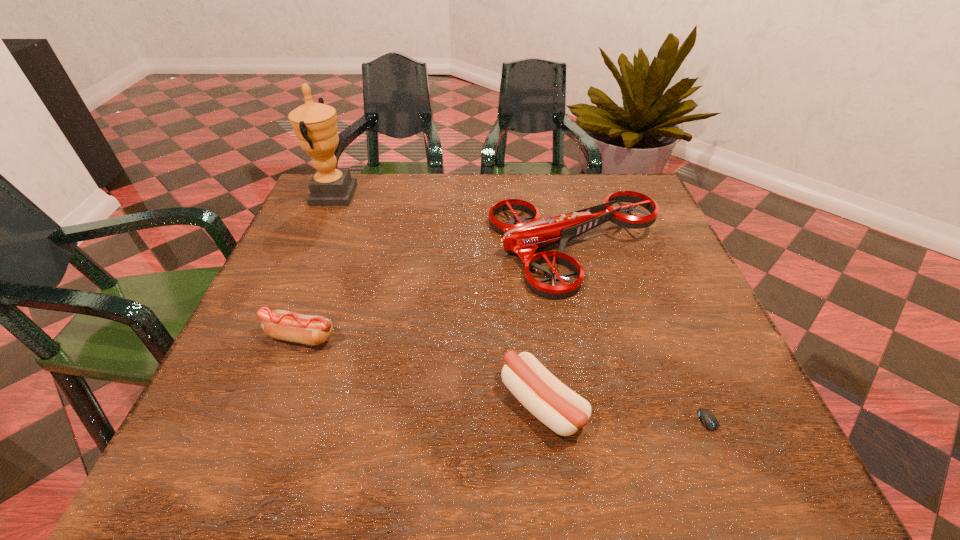
The image size is (960, 540). In order to click on award in this screenshot , I will do `click(315, 124)`.

Where is `drone`? drone is located at coordinates (523, 239).

What are the coordinates of `the third farthest object` in the screenshot? It's located at (286, 325).

In order to click on the left sausage in this screenshot , I will do `click(286, 325)`.

Identify the location of the nearer sausage. This screenshot has height=540, width=960. (561, 409).

The image size is (960, 540). Identify the location of the shortest object. (708, 419).

I want to click on vacant space situated at the front of the tallest object with handles, so click(483, 195).

The width and height of the screenshot is (960, 540). Find the location of `vacant region located on the left of the drone`. vacant region located on the left of the drone is located at coordinates (439, 249).

Locate an element on the screen. vacant point located on the front of the third nearest object is located at coordinates (262, 438).

Where is `vacant space located 0.050m on the back of the right sausage`? Image resolution: width=960 pixels, height=540 pixels. vacant space located 0.050m on the back of the right sausage is located at coordinates (536, 346).